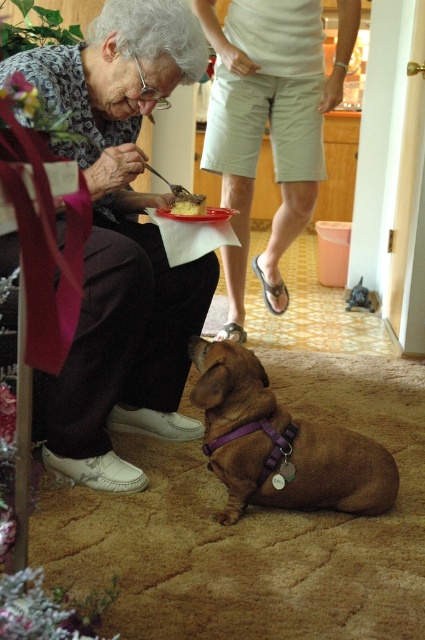
You are a fashion designer observing the image. You need to determine the spatial relationship between the matte black sweater at upper left and the light beige shorts at center. Which object is located below the other?

The matte black sweater at upper left is positioned under the light beige shorts at center, so the sweater is below the shorts.

You are a photographer trying to capture a closeup of the golden crumbly cake at lower center. Based on its 2D coordinates, where should you position your camera relative to the elderly woman?

The golden crumbly cake at lower center is located at coordinates 0.316 on the x axis and 0.440 on the y axis. To capture a closeup, position the camera slightly to the right and above the elderly woman to align with these coordinates.